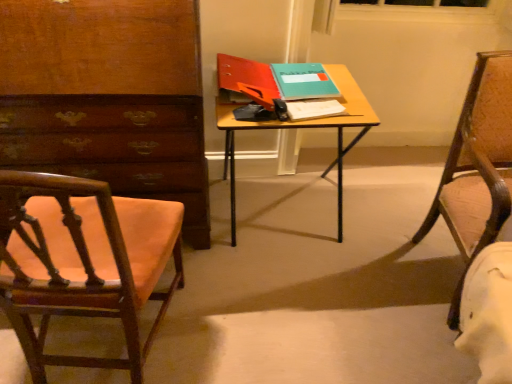
At what (x,y) coordinates should I click in order to perform the action: click on free space behind leather-like brown chair at right, which is the second chair from left to right. Please return your answer as a coordinate pair (x, y). The height and width of the screenshot is (384, 512). Looking at the image, I should click on (395, 201).